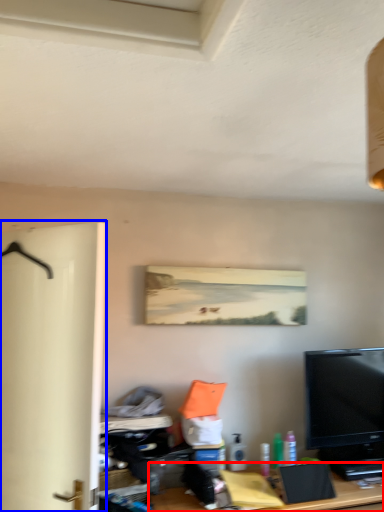
Question: Which object is closer to the camera taking this photo, desk (highlighted by a red box) or door (highlighted by a blue box)?

Choices:
 (A) desk
 (B) door

Answer: (B)